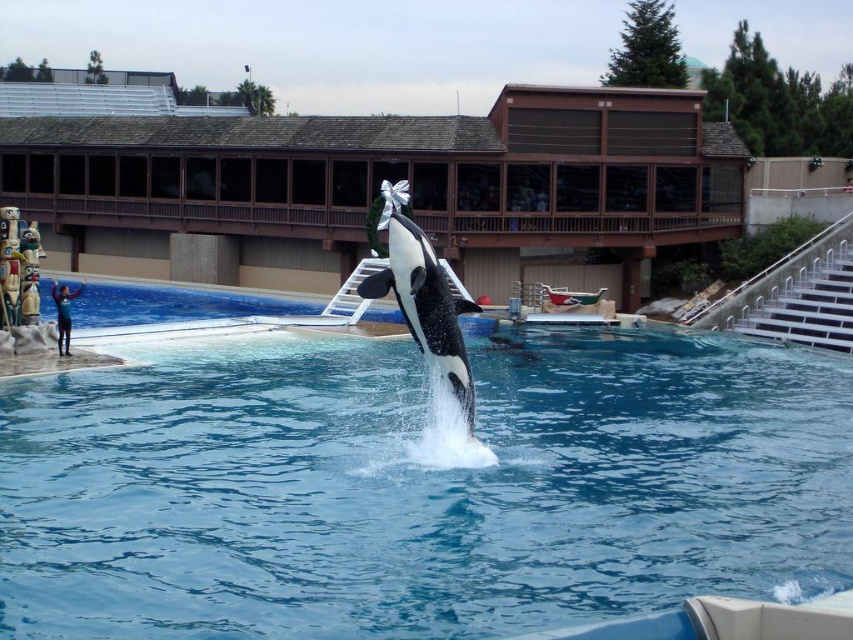
Can you confirm if blue smooth water at center is positioned to the left of black and white dolphin at center?

Correct, you'll find blue smooth water at center to the left of black and white dolphin at center.

Does blue smooth water at center appear under black and white dolphin at center?

Yes, blue smooth water at center is below black and white dolphin at center.

Is point (848, 532) positioned before point (422, 323)?

Yes, point (848, 532) is closer to viewer.

You are a GUI agent. You are given a task and a screenshot of the screen. Output one action in this format:
    pyautogui.click(x=<x>, y=<y>)
    Task: Click on the blue smooth water at center
    This screenshot has width=853, height=640.
    Given the screenshot: What is the action you would take?
    pyautogui.click(x=418, y=486)